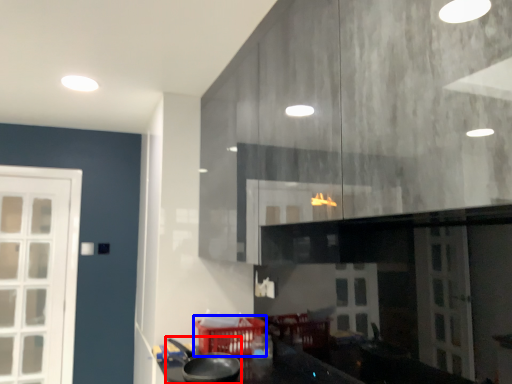
Question: Among these objects, which one is farthest to the camera, wok (highlighted by a red box) or basket (highlighted by a blue box)?

Choices:
 (A) wok
 (B) basket

Answer: (B)